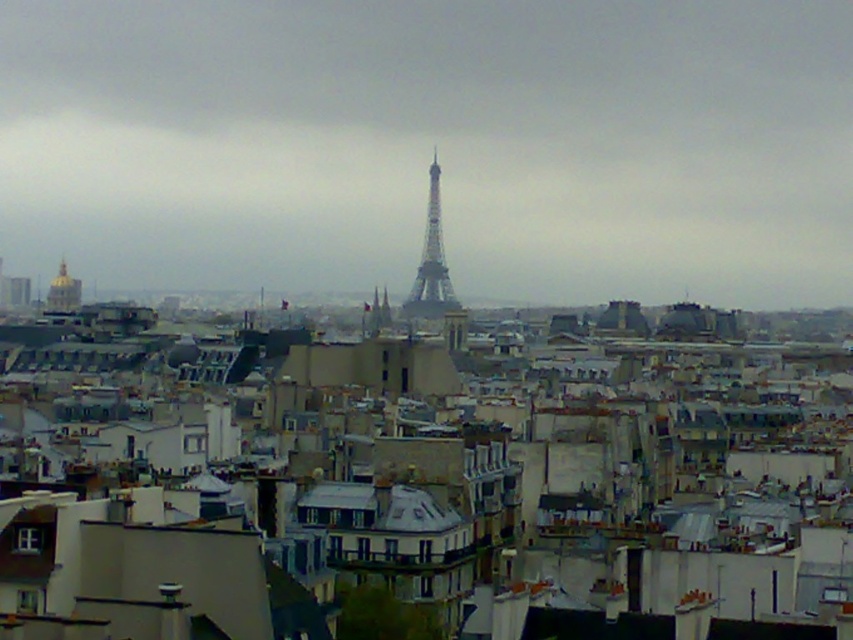
Question: Does transparent glass eiffel tower at center have a smaller size compared to metallic gray eiffel tower at center?

Choices:
 (A) yes
 (B) no

Answer: (B)

Question: Does metallic gray eiffel tower at center appear over gold dome at upper left?

Choices:
 (A) no
 (B) yes

Answer: (B)

Question: Which object is the farthest from the transparent glass eiffel tower at center?

Choices:
 (A) metallic gray eiffel tower at center
 (B) gold dome at upper left

Answer: (B)

Question: Can you confirm if metallic gray eiffel tower at center is positioned to the left of gold dome at upper left?

Choices:
 (A) yes
 (B) no

Answer: (B)

Question: Which of the following is the farthest from the observer?

Choices:
 (A) (434, 198)
 (B) (54, 280)
 (C) (851, 285)

Answer: (C)

Question: Estimate the real-world distances between objects in this image. Which object is farther from the metallic gray eiffel tower at center?

Choices:
 (A) transparent glass eiffel tower at center
 (B) gold dome at upper left

Answer: (B)